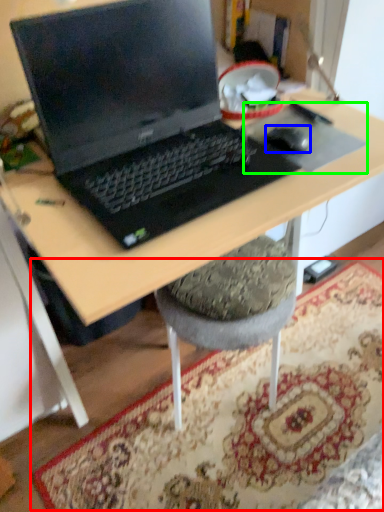
Question: Estimate the real-world distances between objects in this image. Which object is closer to mat (highlighted by a red box), mouse (highlighted by a blue box) or mousepad (highlighted by a green box)?

Choices:
 (A) mouse
 (B) mousepad

Answer: (B)